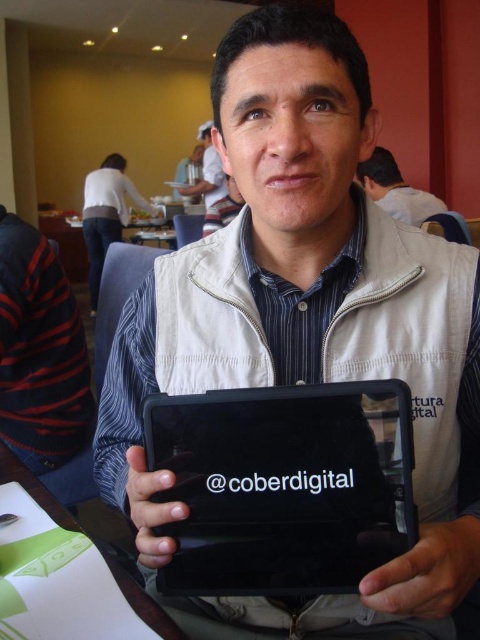
Where is the matte white tablet at upper center located in the image?

The matte white tablet at upper center is located at point coordinates of (x=396, y=189).

You are a delivery robot in a conference room. You need to place a small package on the matte white tablet at upper center, but there is a matte white shirt at upper center nearby. Can you safely place the package on the tablet without disturbing the shirt?

The distance between the matte white tablet at upper center and the matte white shirt at upper center is 6.26 feet. Since the shirt is 6.26 feet away, there is enough space to place the package on the tablet without disturbing the shirt.

In the scene shown: You are a photographer adjusting your camera focus. You need to focus on both the point at (45, 374) and the point at (216, 198). Which point should you focus on first to ensure the closer one is sharp?

You should focus on point (45, 374) first because it is closer to the camera than point (216, 198).